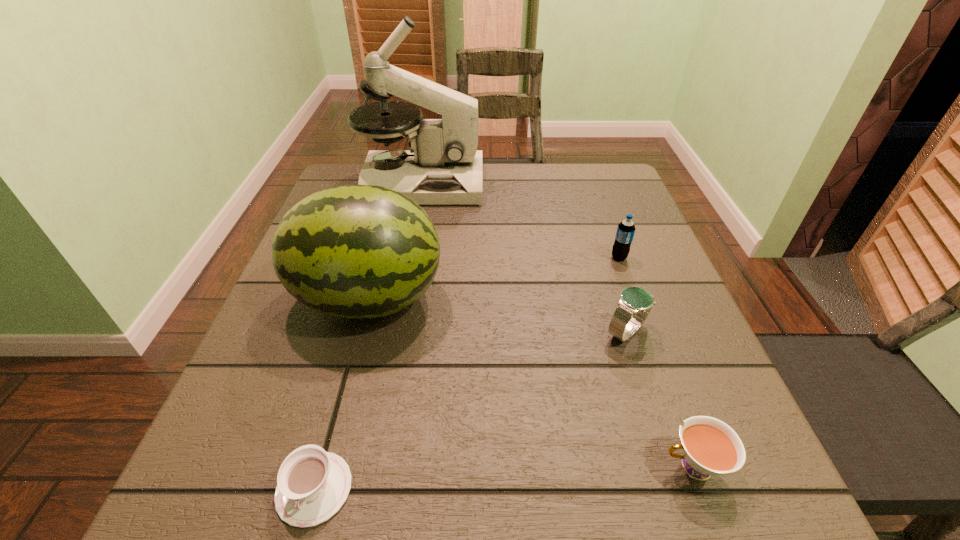
At what (x,y) coordinates should I click in order to perform the action: click on microscope. Please return your answer as a coordinate pair (x, y). This screenshot has height=540, width=960. Looking at the image, I should click on (443, 167).

Where is `the tallest object`? the tallest object is located at coordinates coord(443,167).

Where is `watermelon`? watermelon is located at coordinates (354, 251).

Identify the location of soda bottle. click(625, 232).

You are a GUI agent. You are given a task and a screenshot of the screen. Output one action in this format:
    pyautogui.click(x=<x>, y=<y>)
    Task: Click on the watch
    The height and width of the screenshot is (540, 960).
    Given the screenshot: What is the action you would take?
    pyautogui.click(x=635, y=303)

What are the coordinates of `the fifth tallest object` in the screenshot? It's located at (710, 447).

Where is `the taller teacup`? Image resolution: width=960 pixels, height=540 pixels. the taller teacup is located at coordinates (710, 447).

The height and width of the screenshot is (540, 960). I want to click on the left teacup, so click(312, 485).

You are a GUI agent. You are given a task and a screenshot of the screen. Output one action in this format:
    pyautogui.click(x=<x>, y=<y>)
    Task: Click on the shortest object
    This screenshot has height=540, width=960.
    Given the screenshot: What is the action you would take?
    pyautogui.click(x=312, y=485)

You are a GUI agent. You are given a task and a screenshot of the screen. Output one action in this format:
    pyautogui.click(x=<x>, y=<y>)
    Task: Click on the vacant space located 0.080m at the eyepiece of the tallest object
    
    Given the screenshot: What is the action you would take?
    pyautogui.click(x=512, y=183)